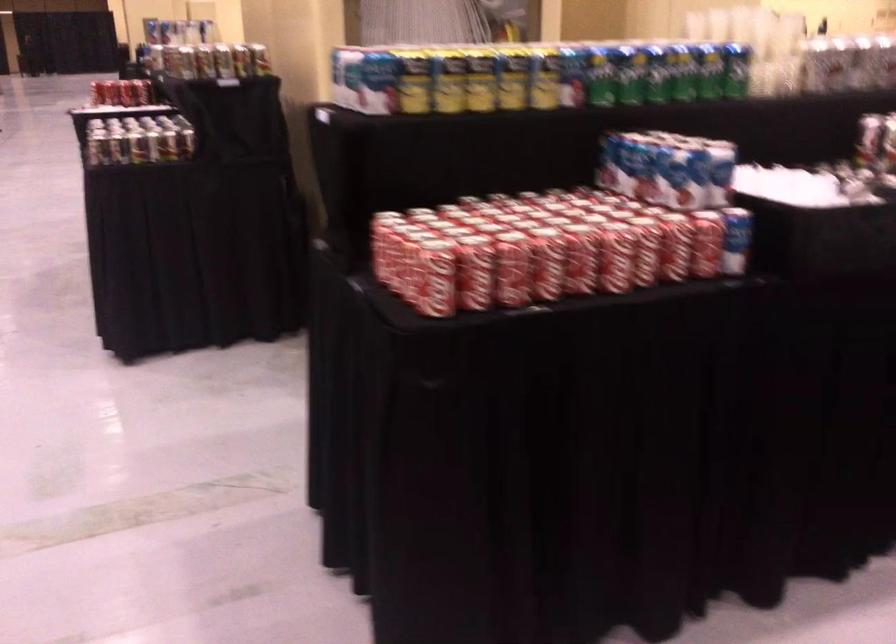
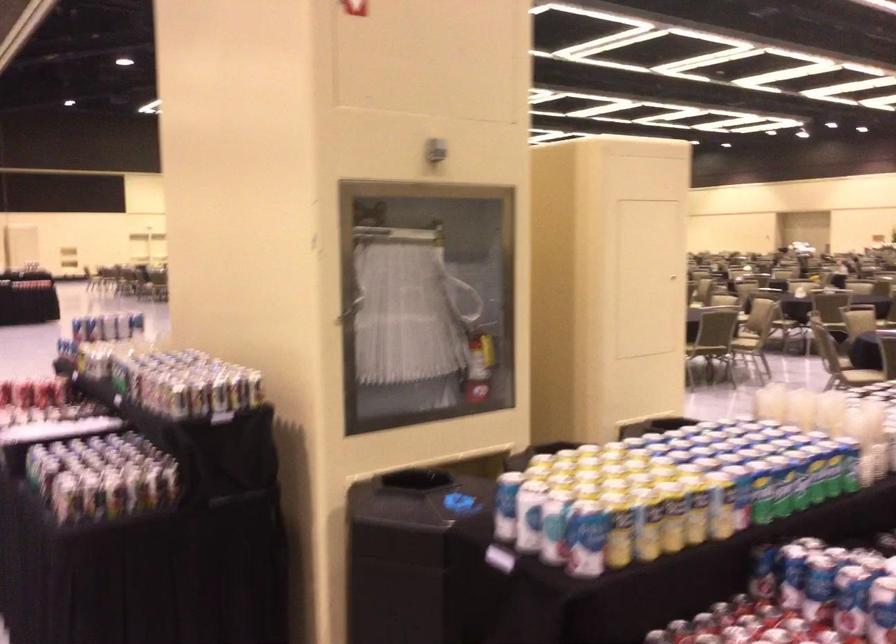
The point at [597,156] is marked in the first image. Where is the corresponding point in the second image?

(762, 572)